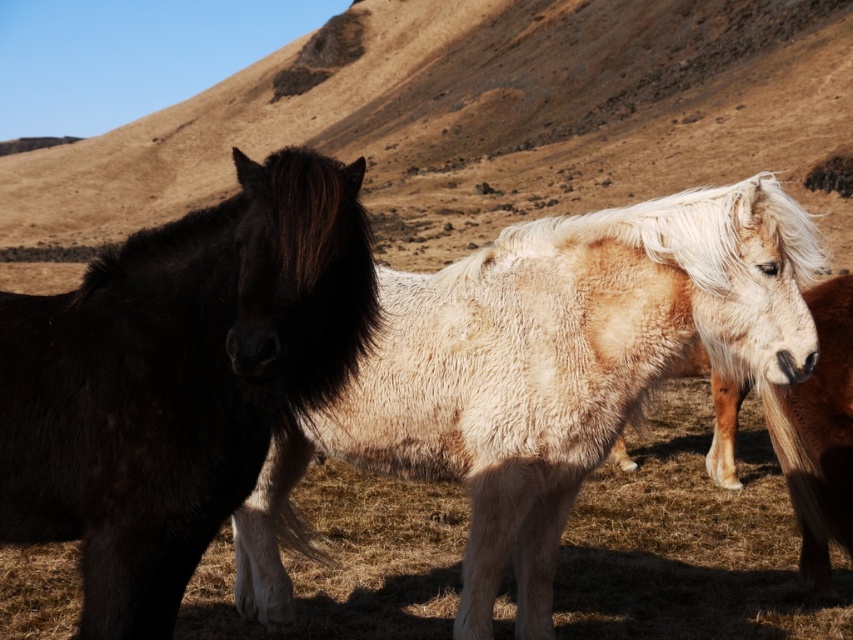
Question: Among these objects, which one is nearest to the camera?

Choices:
 (A) fluffy white horse at center
 (B) shiny black horse at left
 (C) light brown fuzzy horse at right

Answer: (B)

Question: Does fluffy white horse at center come behind light brown fuzzy horse at right?

Choices:
 (A) yes
 (B) no

Answer: (B)

Question: Which point is closer to the camera taking this photo?

Choices:
 (A) (120, 266)
 (B) (810, 566)

Answer: (A)

Question: Can you confirm if fluffy white horse at center is positioned to the left of light brown fuzzy horse at right?

Choices:
 (A) no
 (B) yes

Answer: (B)

Question: Which point is closer to the camera?

Choices:
 (A) (793, 452)
 (B) (222, 356)

Answer: (B)

Question: Is fluffy white horse at center above shiny black horse at left?

Choices:
 (A) yes
 (B) no

Answer: (B)